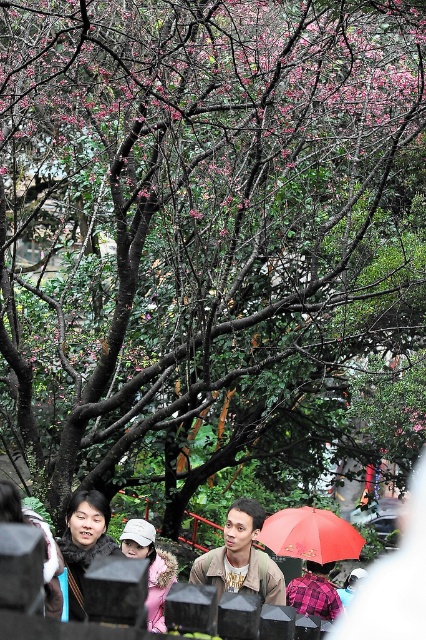
Question: Where is red matte umbrella at center located in relation to pink fabric hat at lower center in the image?

Choices:
 (A) above
 (B) below

Answer: (B)

Question: Which object is the farthest from the red matte umbrella at center?

Choices:
 (A) pink fabric hat at lower center
 (B) brown leather jacket at center

Answer: (B)

Question: Among these points, which one is nearest to the camera?

Choices:
 (A) (250, 502)
 (B) (279, 512)

Answer: (A)

Question: Is the position of red matte umbrella at center more distant than that of matte black jacket at lower left?

Choices:
 (A) no
 (B) yes

Answer: (B)

Question: Which object is closer to the camera taking this photo?

Choices:
 (A) brown leather jacket at center
 (B) matte black jacket at lower left
 (C) pink fabric hat at lower center

Answer: (C)

Question: Can you confirm if brown leather jacket at center is thinner than pink fabric hat at lower center?

Choices:
 (A) no
 (B) yes

Answer: (B)